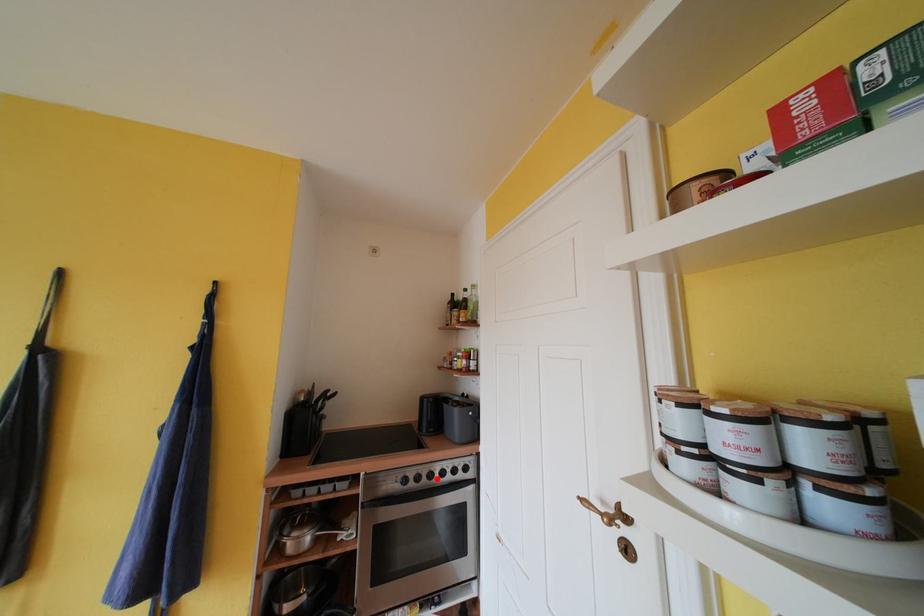
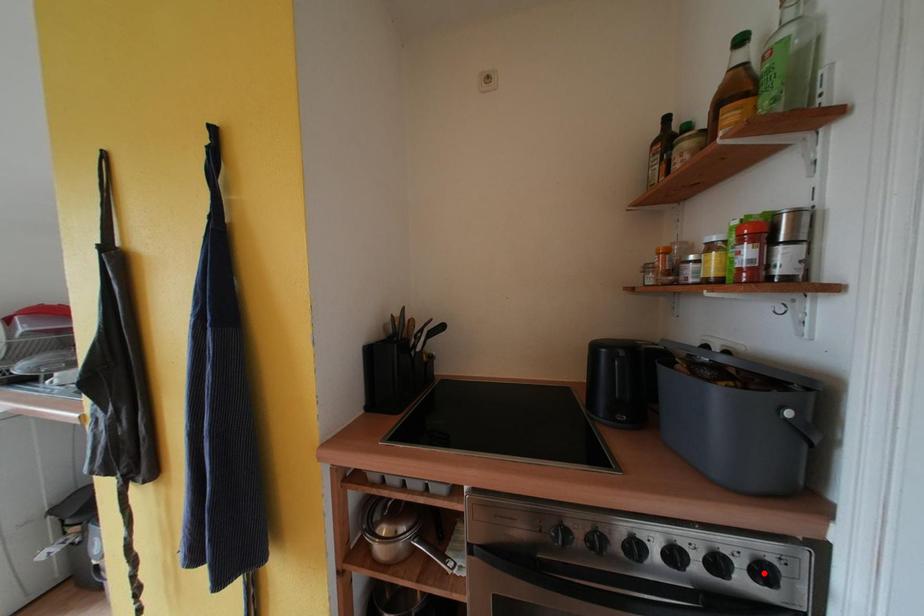
I am providing you with two images of the same scene from different viewpoints. A red point is marked on the first image and another point is marked on the second image. Is the red point in image1 aligned with the point shown in image2?

No